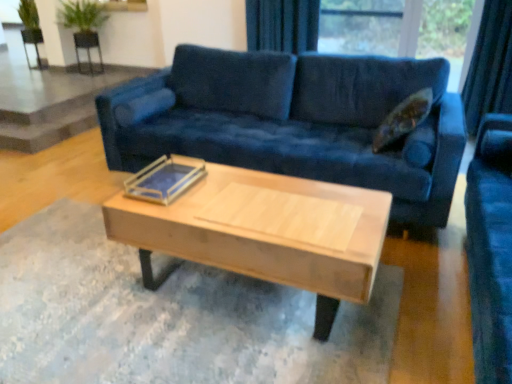
Question: Based on their positions, is black mesh chair at upper left, positioned as the first armchair in right-to-left order, located to the left or right of metallic silver armchair at upper left, marked as the first armchair in a left-to-right arrangement?

Choices:
 (A) right
 (B) left

Answer: (A)

Question: From their relative heights in the image, would you say black mesh chair at upper left, the second armchair when ordered from left to right, is taller or shorter than metallic silver armchair at upper left, marked as the first armchair in a left-to-right arrangement?

Choices:
 (A) tall
 (B) short

Answer: (B)

Question: Which object is positioned closest to the velvet blue couch at center?

Choices:
 (A) velvet dark blue curtain at upper center
 (B) metallic silver armchair at upper left, the second armchair in the right-to-left sequence
 (C) clear acrylic tray at center
 (D) black mesh chair at upper left, the second armchair when ordered from left to right
 (E) light wood/wooden coffee table at center

Answer: (E)

Question: Which object is positioned closest to the velvet dark blue curtain at upper center?

Choices:
 (A) clear acrylic tray at center
 (B) velvet blue couch at center
 (C) black mesh chair at upper left, positioned as the first armchair in right-to-left order
 (D) light wood/wooden coffee table at center
 (E) metallic silver armchair at upper left, the second armchair in the right-to-left sequence

Answer: (B)